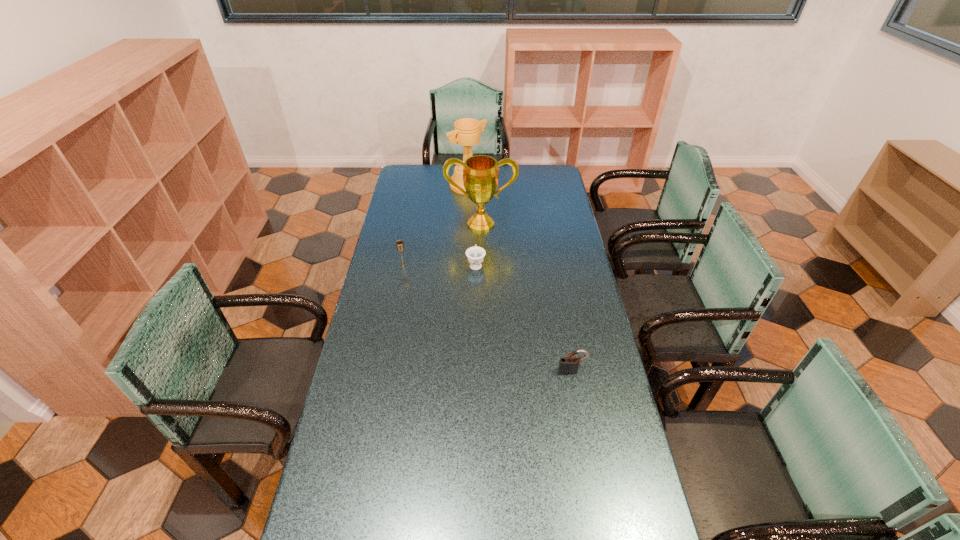
Find the location of a particular element. the farthest object is located at coordinates (466, 133).

The height and width of the screenshot is (540, 960). In order to click on the fourth nearest object in this screenshot , I will do `click(480, 172)`.

The height and width of the screenshot is (540, 960). What are the coordinates of `chalice` in the screenshot? It's located at (399, 244).

Where is `padlock`? Image resolution: width=960 pixels, height=540 pixels. padlock is located at coordinates (568, 365).

Locate an element on the screen. This screenshot has width=960, height=540. the nearest object is located at coordinates (568, 365).

At what (x,y) coordinates should I click in order to perform the action: click on the shortest object. Please return your answer as a coordinate pair (x, y). The image size is (960, 540). Looking at the image, I should click on (475, 254).

Identify the location of free region located on the front of the farthest object. (468, 205).

The width and height of the screenshot is (960, 540). What are the coordinates of `free space located on the front-facing side of the nearer award` in the screenshot? It's located at (481, 266).

Image resolution: width=960 pixels, height=540 pixels. In order to click on free space located on the front of the chalice in this screenshot , I will do `click(392, 327)`.

At what (x,y) coordinates should I click in order to perform the action: click on vacant space located 0.080m with the keyhole on the front of the rightmost object. Please return your answer as a coordinate pair (x, y). This screenshot has width=960, height=540. Looking at the image, I should click on (576, 395).